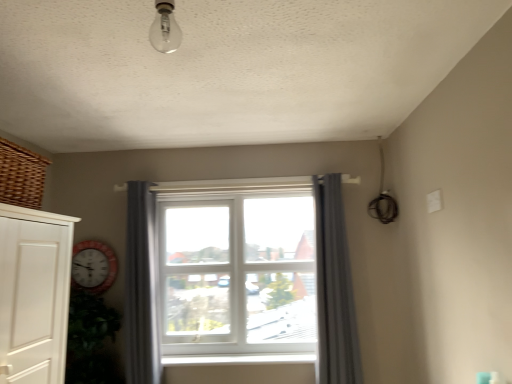
Question: In terms of height, does woven brown basket at upper left look taller or shorter compared to clear glass bulb at upper center?

Choices:
 (A) short
 (B) tall

Answer: (A)

Question: From a real-world perspective, relative to clear glass bulb at upper center, is woven brown basket at upper left vertically above or below?

Choices:
 (A) below
 (B) above

Answer: (A)

Question: Considering the real-world distances, which object is closest to the woven brown basket at upper left?

Choices:
 (A) clear glass bulb at upper center
 (B) white plastic window at center
 (C) white plastic window sill at center
 (D) gray fabric curtain at center, the first curtain from the right
 (E) white wooden clock at left

Answer: (A)

Question: Considering the real-world distances, which object is farthest from the white plastic window sill at center?

Choices:
 (A) woven brown basket at upper left
 (B) gray fabric curtain at center, the second curtain positioned from the right
 (C) white wooden clock at left
 (D) clear glass bulb at upper center
 (E) gray fabric curtain at center, the first curtain from the right

Answer: (D)